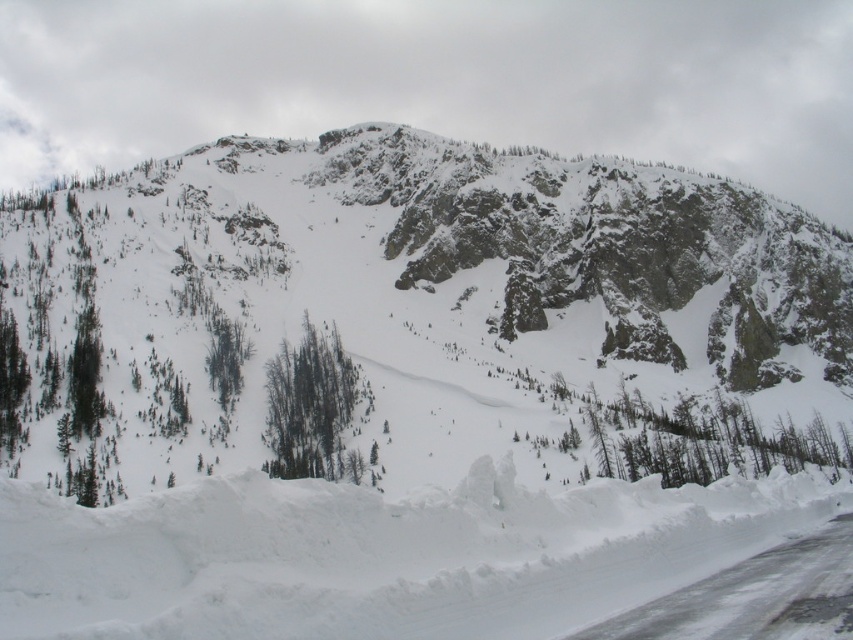
Describe the element at coordinates (378, 556) in the screenshot. I see `white snow at center` at that location.

Who is lower down, white snow at center or green matte trees at center?

white snow at center is below.

Is point (706, 497) farther from viewer compared to point (321, 387)?

No, it is in front of (321, 387).

The height and width of the screenshot is (640, 853). I want to click on white snow at center, so click(378, 556).

Between white rocky mountain at center and white snow at center, which one has more height?

white rocky mountain at center is taller.

Is point (349, 461) farther from viewer compared to point (740, 529)?

That is True.

Between point (85, 468) and point (311, 620), which one is positioned in front?

Positioned in front is point (311, 620).

Locate an element on the screen. This screenshot has height=640, width=853. white rocky mountain at center is located at coordinates (415, 317).

Is the position of white rocky mountain at center more distant than that of green matte trees at center?

No, it is not.

I want to click on white rocky mountain at center, so click(x=415, y=317).